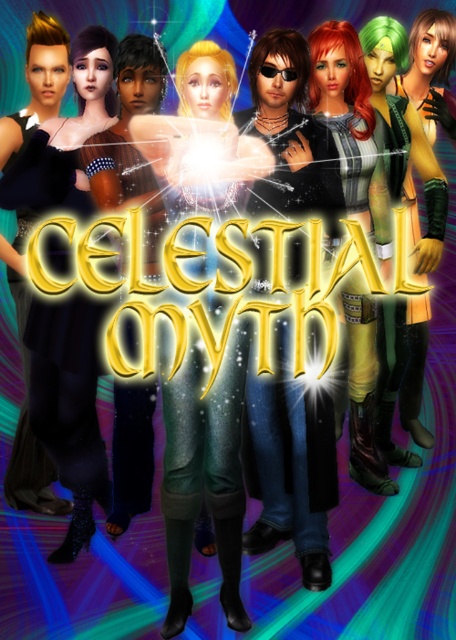
Question: Estimate the real-world distances between objects in this image. Which object is closer to the green matte jacket at right?

Choices:
 (A) green matte boots at center
 (B) shiny black leather jacket at center
 (C) shiny red hair at center
 (D) matte black dress at center

Answer: (C)

Question: Which is nearer to the matte black dress at center?

Choices:
 (A) green matte jacket at right
 (B) shiny red hair at center

Answer: (B)

Question: Does shiny black leather jacket at center have a smaller size compared to green matte jacket at right?

Choices:
 (A) no
 (B) yes

Answer: (B)

Question: Is shiny red hair at center positioned at the back of matte black dress at center?

Choices:
 (A) no
 (B) yes

Answer: (B)

Question: Which is nearer to the green matte jacket at right?

Choices:
 (A) green matte boots at center
 (B) shiny black leather jacket at center

Answer: (B)

Question: Does green matte boots at center come behind shiny red hair at center?

Choices:
 (A) yes
 (B) no

Answer: (B)